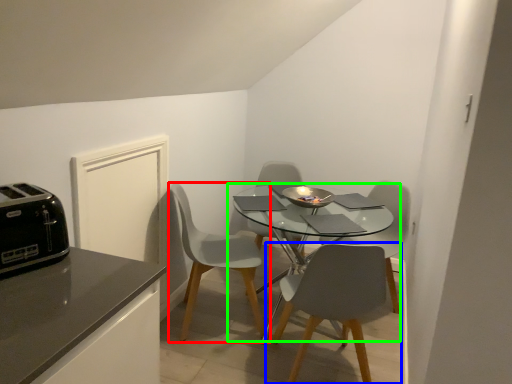
Question: Which is farther away from chair (highlighted by a red box)? chair (highlighted by a blue box) or kitchen & dining room table (highlighted by a green box)?

Choices:
 (A) chair
 (B) kitchen & dining room table

Answer: (A)